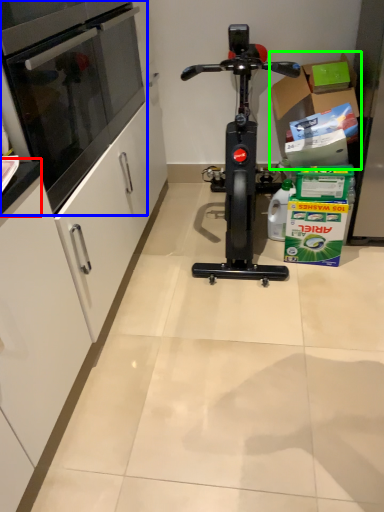
Question: Estimate the real-world distances between objects in this image. Which object is farther from counter top (highlighted by a red box), oven (highlighted by a blue box) or cardboard box (highlighted by a green box)?

Choices:
 (A) oven
 (B) cardboard box

Answer: (B)